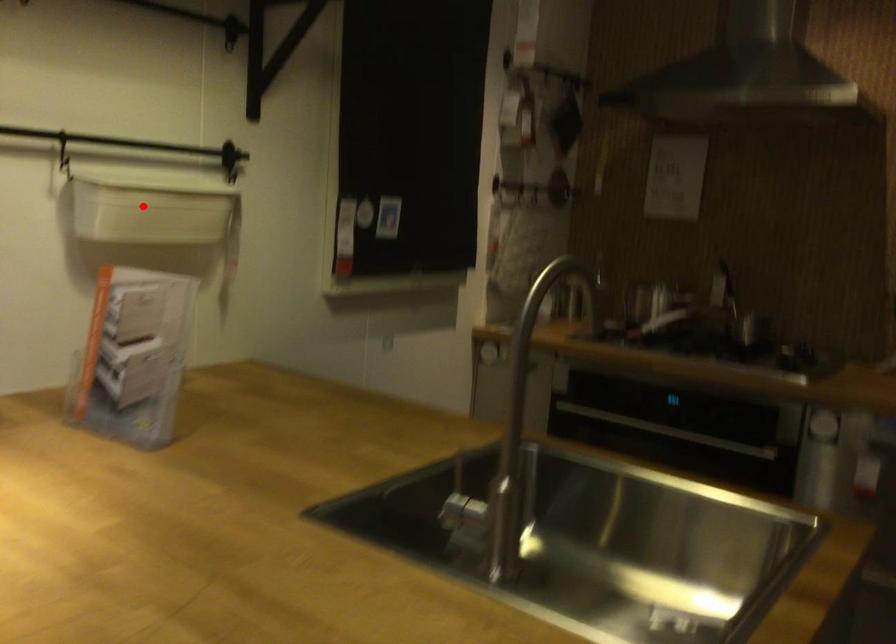
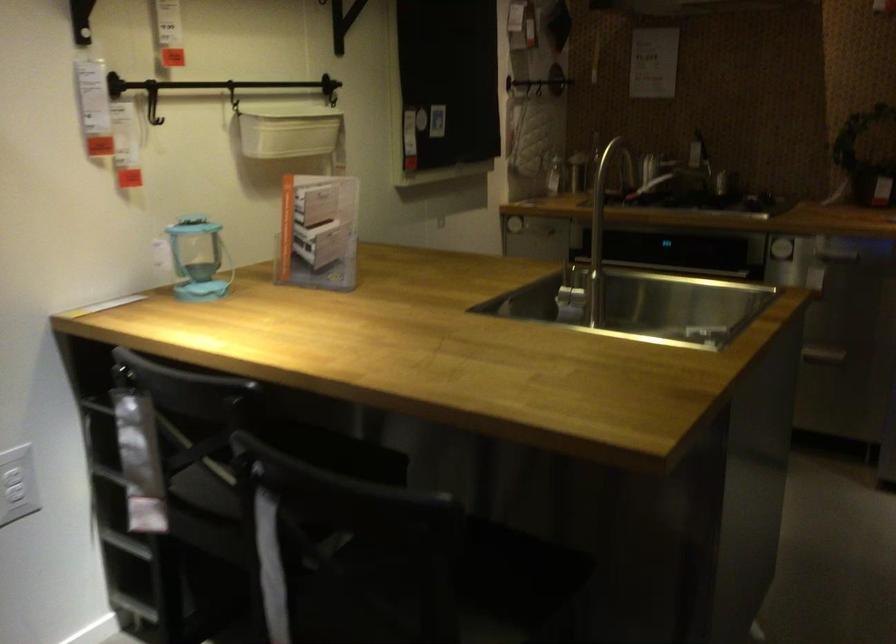
Locate, in the second image, the point that corresponds to the highlighted location in the first image.

(287, 129)